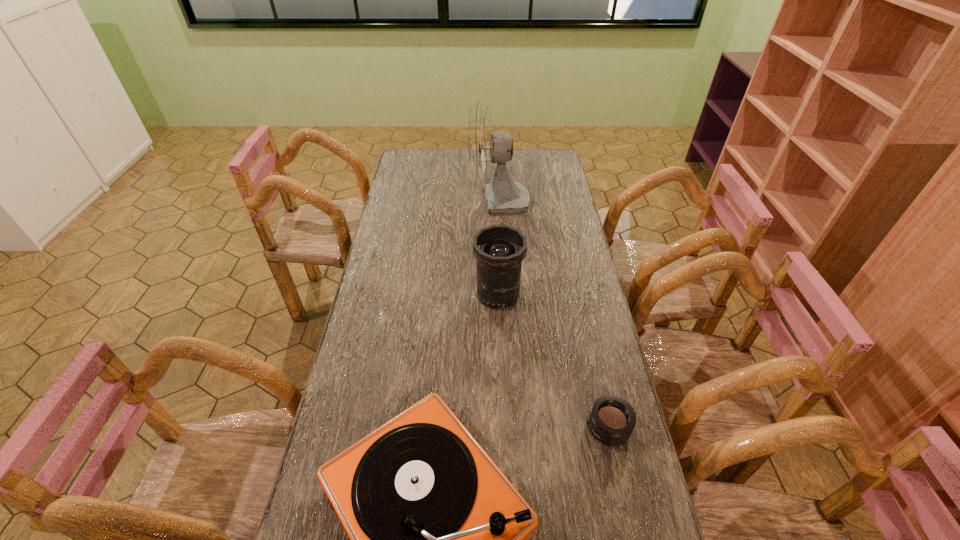
I want to click on free space that is in between the nearer telephoto lens and the tallest object, so click(x=553, y=315).

Identify which object is the second nearest to the third tallest object. Please provide its 2D coordinates. Your answer should be formatted as a tuple, i.e. [(x, y)], where the tuple contains the x and y coordinates of a point satisfying the conditions above.

[(499, 249)]

Identify the location of object that is the second closest to the second tallest object. The image size is (960, 540). (439, 538).